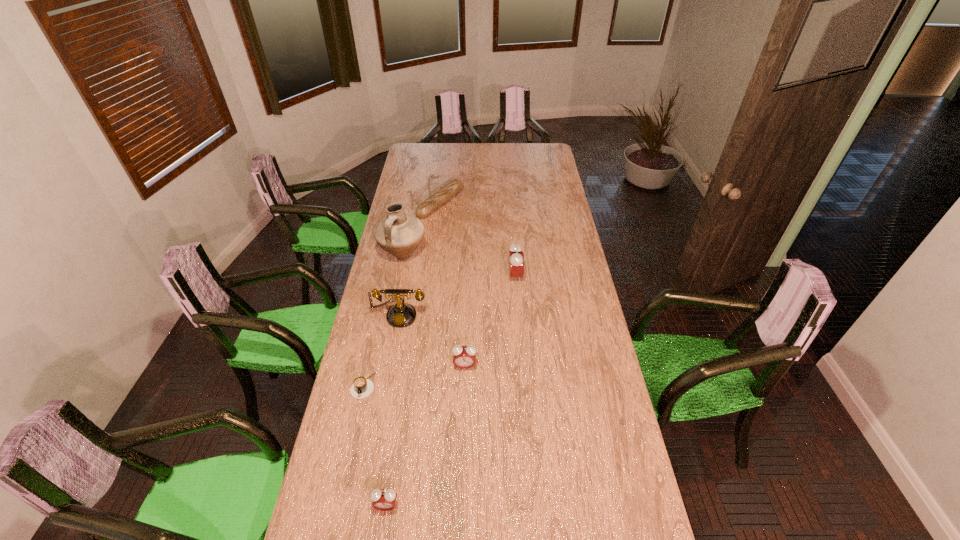
Select which alarm clock is the second closest to the fourth shortest object. Please provide its 2D coordinates. Your answer should be formatted as a tuple, i.e. [(x, y)], where the tuple contains the x and y coordinates of a point satisfying the conditions above.

[(383, 499)]

What are the coordinates of `alarm clock that is the second closest to the pitcher` in the screenshot? It's located at (464, 357).

The height and width of the screenshot is (540, 960). I want to click on free region that satisfies the following two spatial constraints: 1. on the clock face of the rightmost object; 2. with the handle on the side of the sixth farthest object, so click(524, 386).

This screenshot has height=540, width=960. Find the location of `vacant region that satisfies the following two spatial constraints: 1. on the clock face of the farthest alarm clock; 2. on the clock face of the fifth farthest object`. vacant region that satisfies the following two spatial constraints: 1. on the clock face of the farthest alarm clock; 2. on the clock face of the fifth farthest object is located at coordinates (522, 366).